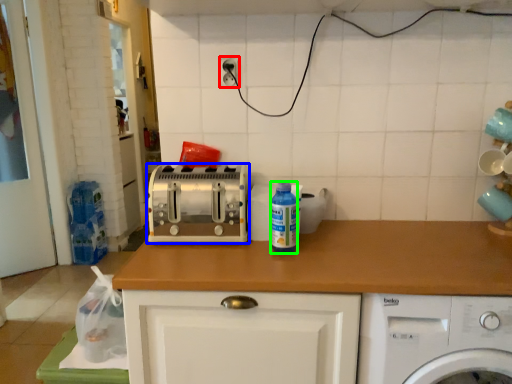
Question: Considering the real-world distances, which object is farthest from electric outlet (highlighted by a red box)? toaster (highlighted by a blue box) or bottle (highlighted by a green box)?

Choices:
 (A) toaster
 (B) bottle

Answer: (B)